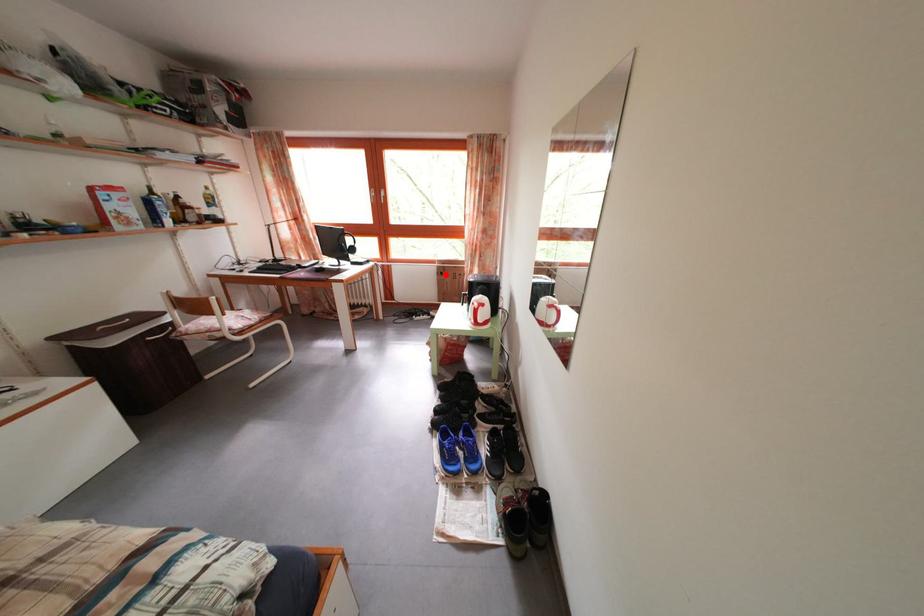
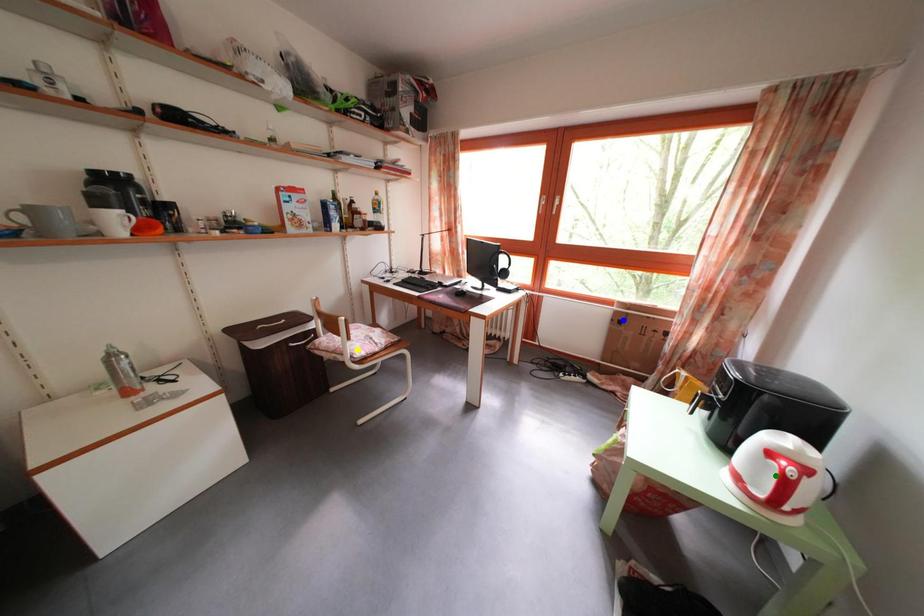
Question: I am providing you with two images of the same scene from different viewpoints. A red point is marked on the first image. You are given multiple points on the second image. Can you choose the point in image 2 that corresponds to the point in image 1?

Choices:
 (A) blue point
 (B) yellow point
 (C) green point

Answer: (A)